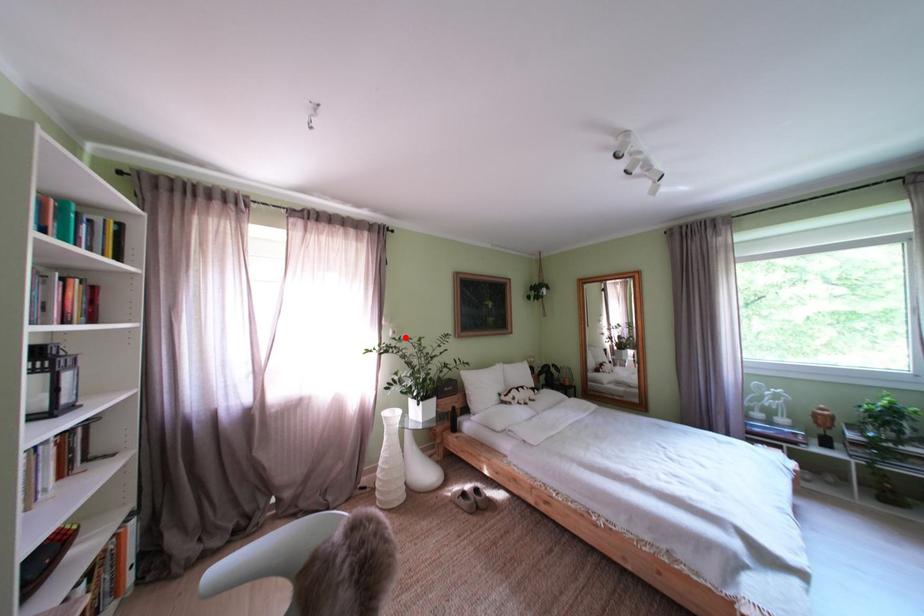
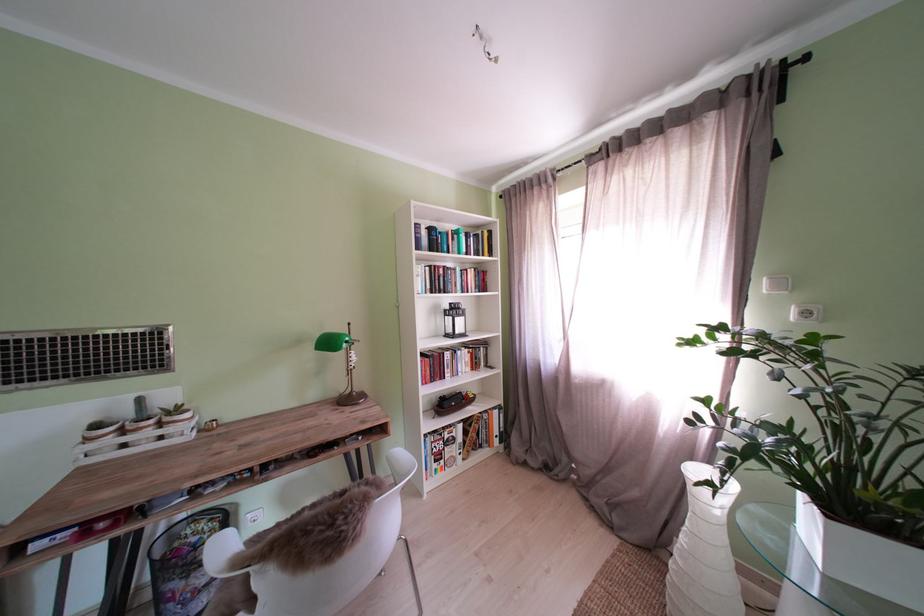
In the second image, find the point that corresponds to the highlighted location in the first image.

(818, 318)